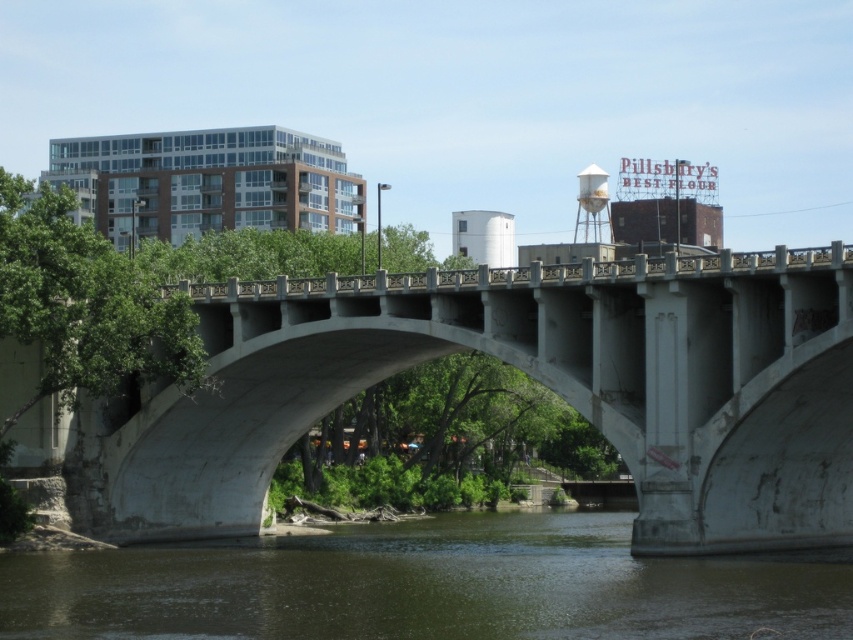
From the picture: Can you confirm if brown murky water at lower center is positioned below white matte water tower at upper center?

Indeed, brown murky water at lower center is positioned under white matte water tower at upper center.

Does brown murky water at lower center have a greater height compared to white matte water tower at upper center?

Incorrect, brown murky water at lower center's height is not larger of white matte water tower at upper center's.

Between point (642, 632) and point (593, 228), which one is positioned behind?

The point (593, 228) is more distant.

You are a GUI agent. You are given a task and a screenshot of the screen. Output one action in this format:
    pyautogui.click(x=<x>, y=<y>)
    Task: Click on the brown murky water at lower center
    The image size is (853, 640).
    Given the screenshot: What is the action you would take?
    pyautogui.click(x=425, y=586)

Can you confirm if white concrete bridge at center is wider than white matte water tower at upper center?

Yes, white concrete bridge at center is wider than white matte water tower at upper center.

The width and height of the screenshot is (853, 640). What do you see at coordinates (532, 378) in the screenshot?
I see `white concrete bridge at center` at bounding box center [532, 378].

Identify the location of white concrete bridge at center. (532, 378).

Who is higher up, white concrete bridge at center or brown murky water at lower center?

white concrete bridge at center is higher up.

Does white concrete bridge at center have a larger size compared to brown murky water at lower center?

Correct, white concrete bridge at center is larger in size than brown murky water at lower center.

Is point (688, 502) closer to camera compared to point (589, 529)?

Yes, point (688, 502) is closer to viewer.

I want to click on white concrete bridge at center, so click(532, 378).